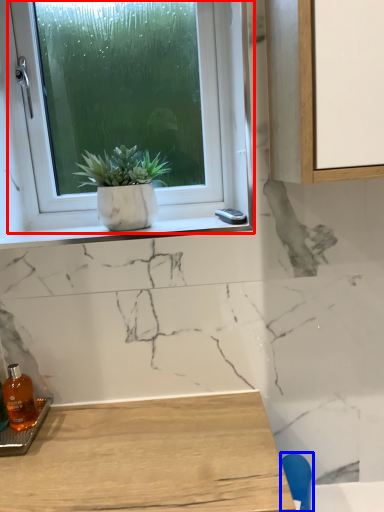
Question: Which object appears farthest to the camera in this image, window (highlighted by a red box) or chair (highlighted by a blue box)?

Choices:
 (A) window
 (B) chair

Answer: (A)